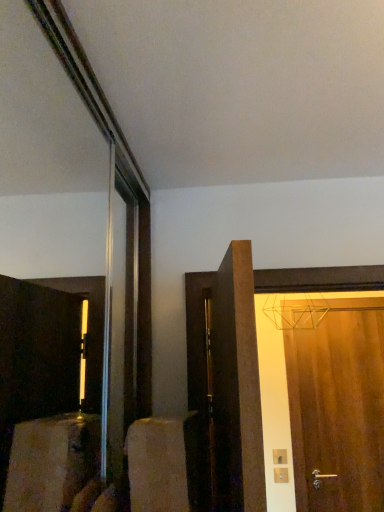
Describe the element at coordinates (226, 384) in the screenshot. I see `dark wood door at center, the second door in the right-to-left sequence` at that location.

You are a GUI agent. You are given a task and a screenshot of the screen. Output one action in this format:
    pyautogui.click(x=<x>, y=<y>)
    Task: Click on the dark wood door at center, the first door viewed from the front
    The height and width of the screenshot is (512, 384).
    Given the screenshot: What is the action you would take?
    pyautogui.click(x=226, y=384)

What is the approximate width of wooden door at right, positioned as the 2th door in front-to-back order?

wooden door at right, positioned as the 2th door in front-to-back order, is 4.20 inches wide.

Describe the element at coordinates (338, 411) in the screenshot. I see `wooden door at right, which is the 1th door from right to left` at that location.

Identify the location of wooden door at right, positioned as the 2th door in front-to-back order. Image resolution: width=384 pixels, height=512 pixels. (338, 411).

This screenshot has height=512, width=384. Identify the location of dark wood door at center, the second door positioned from the back. (226, 384).

Can you confirm if dark wood door at center, the second door positioned from the back, is positioned to the left of wooden door at right, positioned as the 2th door in front-to-back order?

Correct, you'll find dark wood door at center, the second door positioned from the back, to the left of wooden door at right, positioned as the 2th door in front-to-back order.

Between dark wood door at center, the second door in the right-to-left sequence, and wooden door at right, positioned as the 2th door in front-to-back order, which one is positioned in front?

dark wood door at center, the second door in the right-to-left sequence, is more forward.

Considering the points (203, 483) and (382, 365), which point is behind, point (203, 483) or point (382, 365)?

The point (382, 365) is farther from the camera.

From the image's perspective, would you say dark wood door at center, the first door viewed from the front, is shown under wooden door at right, which is the 1th door from right to left?

No, from the image's perspective, dark wood door at center, the first door viewed from the front, is not beneath wooden door at right, which is the 1th door from right to left.

From a real-world perspective, between dark wood door at center, the second door in the right-to-left sequence, and wooden door at right, which is the 1th door from right to left, who is vertically lower?

From a 3D spatial view, wooden door at right, which is the 1th door from right to left, is below.

Considering the sizes of objects dark wood door at center, the second door positioned from the back, and wooden door at right, the second door from the left, in the image provided, who is thinner, dark wood door at center, the second door positioned from the back, or wooden door at right, the second door from the left,?

wooden door at right, the second door from the left.

Between dark wood door at center, the second door in the right-to-left sequence, and wooden door at right, placed as the 1th door when sorted from back to front, which one has more height?

wooden door at right, placed as the 1th door when sorted from back to front.

Considering the relative sizes of dark wood door at center, the second door in the right-to-left sequence, and wooden door at right, the second door from the left, in the image provided, is dark wood door at center, the second door in the right-to-left sequence, smaller than wooden door at right, the second door from the left,?

Actually, dark wood door at center, the second door in the right-to-left sequence, might be larger than wooden door at right, the second door from the left.

Is dark wood door at center, the second door positioned from the back, outside of wooden door at right, the second door from the left?

Yes, dark wood door at center, the second door positioned from the back, is not within wooden door at right, the second door from the left.

From the picture: Is dark wood door at center, which ranks as the 1th door in left-to-right order, positioned far away from wooden door at right, placed as the 1th door when sorted from back to front?

Yes, dark wood door at center, which ranks as the 1th door in left-to-right order, and wooden door at right, placed as the 1th door when sorted from back to front, are located far from each other.

Does dark wood door at center, the second door in the right-to-left sequence, turn towards wooden door at right, the second door from the left?

No, dark wood door at center, the second door in the right-to-left sequence, does not turn towards wooden door at right, the second door from the left.

What's the angular difference between dark wood door at center, the first door viewed from the front, and wooden door at right, positioned as the 2th door in front-to-back order,'s facing directions?

96.2 degrees.

In order to click on door on the left of the wooden door at right, positioned as the 2th door in front-to-back order in this screenshot , I will do `click(226, 384)`.

Based on their positions, is wooden door at right, placed as the 1th door when sorted from back to front, located to the left or right of dark wood door at center, the second door in the right-to-left sequence?

From the image, it's evident that wooden door at right, placed as the 1th door when sorted from back to front, is to the right of dark wood door at center, the second door in the right-to-left sequence.

Which object is closer to the camera taking this photo, wooden door at right, the second door from the left, or dark wood door at center, the second door positioned from the back?

dark wood door at center, the second door positioned from the back.

Is point (314, 406) closer to viewer compared to point (198, 361)?

That is False.

From the image's perspective, is wooden door at right, placed as the 1th door when sorted from back to front, on dark wood door at center, the second door positioned from the back?

No.

From a real-world perspective, is wooden door at right, the second door from the left, beneath dark wood door at center, which ranks as the 1th door in left-to-right order?

Yes.

Can you confirm if wooden door at right, which is the 1th door from right to left, is thinner than dark wood door at center, which ranks as the 1th door in left-to-right order?

Indeed, wooden door at right, which is the 1th door from right to left, has a lesser width compared to dark wood door at center, which ranks as the 1th door in left-to-right order.

Which of these two, wooden door at right, placed as the 1th door when sorted from back to front, or dark wood door at center, which ranks as the 1th door in left-to-right order, stands shorter?

Standing shorter between the two is dark wood door at center, which ranks as the 1th door in left-to-right order.

Does wooden door at right, placed as the 1th door when sorted from back to front, have a larger size compared to dark wood door at center, the first door viewed from the front?

No, wooden door at right, placed as the 1th door when sorted from back to front, is not bigger than dark wood door at center, the first door viewed from the front.

Looking at this image, is wooden door at right, the second door from the left, inside the boundaries of dark wood door at center, which ranks as the 1th door in left-to-right order, or outside?

The correct answer is: outside.

Is wooden door at right, placed as the 1th door when sorted from back to front, not close to dark wood door at center, the second door positioned from the back?

That's right, there is a large distance between wooden door at right, placed as the 1th door when sorted from back to front, and dark wood door at center, the second door positioned from the back.

Is wooden door at right, positioned as the 2th door in front-to-back order, oriented away from dark wood door at center, the second door in the right-to-left sequence?

No, wooden door at right, positioned as the 2th door in front-to-back order, is not facing the opposite direction of dark wood door at center, the second door in the right-to-left sequence.

How far apart are wooden door at right, the second door from the left, and dark wood door at center, which ranks as the 1th door in left-to-right order?

wooden door at right, the second door from the left, and dark wood door at center, which ranks as the 1th door in left-to-right order, are 4.92 feet apart.

Find the location of a particular element. The width and height of the screenshot is (384, 512). door above the wooden door at right, positioned as the 2th door in front-to-back order (from a real-world perspective) is located at coordinates (226, 384).

Where is `door in front of the wooden door at right, placed as the 1th door when sorted from back to front`? The width and height of the screenshot is (384, 512). door in front of the wooden door at right, placed as the 1th door when sorted from back to front is located at coordinates (226, 384).

Locate an element on the screen. door on the right of dark wood door at center, the first door viewed from the front is located at coordinates (338, 411).